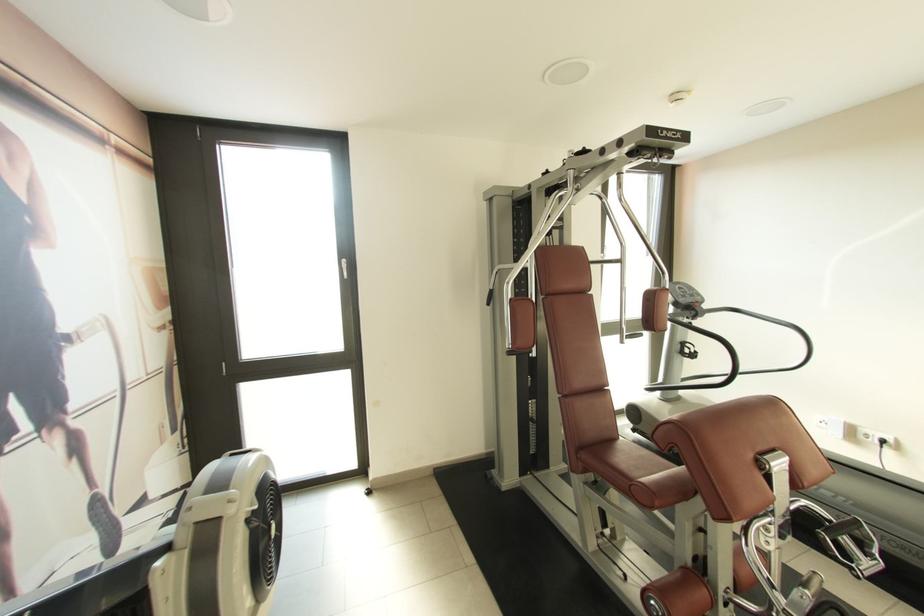
Image resolution: width=924 pixels, height=616 pixels. What do you see at coordinates (676, 594) in the screenshot? I see `the brown leather roller` at bounding box center [676, 594].